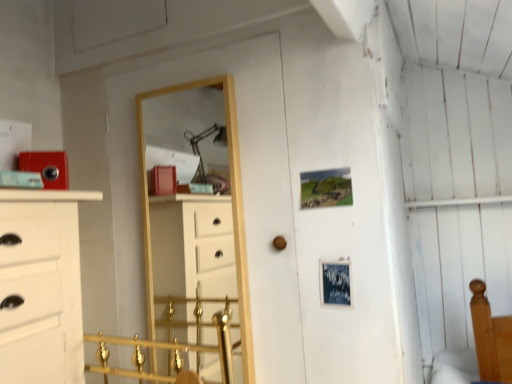
Image resolution: width=512 pixels, height=384 pixels. What do you see at coordinates (279, 243) in the screenshot? I see `brown matte door handle at center` at bounding box center [279, 243].

Identify the location of brown matte door handle at center. The width and height of the screenshot is (512, 384). (279, 243).

Where is `gold wooden mirror at center`? gold wooden mirror at center is located at coordinates (232, 211).

What is the approximate width of gold wooden mirror at center?

gold wooden mirror at center is 1.71 inches wide.

This screenshot has width=512, height=384. Describe the element at coordinates (232, 211) in the screenshot. I see `gold wooden mirror at center` at that location.

The image size is (512, 384). I want to click on brown matte door handle at center, so click(279, 243).

Considering the positions of objects brown matte door handle at center and gold wooden mirror at center in the image provided, who is more to the right, brown matte door handle at center or gold wooden mirror at center?

Positioned to the right is brown matte door handle at center.

Consider the image. In the image, is brown matte door handle at center positioned in front of or behind gold wooden mirror at center?

Visually, brown matte door handle at center is located in front of gold wooden mirror at center.

Which point is more distant from viewer, [278,244] or [142,117]?

The point [142,117] is behind.

From the image's perspective, would you say brown matte door handle at center is positioned over gold wooden mirror at center?

No, from the image's perspective, brown matte door handle at center is not over gold wooden mirror at center.

Consider the image. From a real-world perspective, who is located higher, brown matte door handle at center or gold wooden mirror at center?

From a 3D spatial view, gold wooden mirror at center is above.

Which object is wider, brown matte door handle at center or gold wooden mirror at center?

Wider between the two is gold wooden mirror at center.

Is brown matte door handle at center shorter than gold wooden mirror at center?

Yes, brown matte door handle at center is shorter than gold wooden mirror at center.

Considering the sizes of objects brown matte door handle at center and gold wooden mirror at center in the image provided, who is smaller, brown matte door handle at center or gold wooden mirror at center?

brown matte door handle at center is smaller.

Is brown matte door handle at center spatially inside gold wooden mirror at center, or outside of it?

brown matte door handle at center lies outside gold wooden mirror at center.

Is brown matte door handle at center not near gold wooden mirror at center?

Actually, brown matte door handle at center and gold wooden mirror at center are a little close together.

Could you tell me if brown matte door handle at center is facing gold wooden mirror at center?

No, brown matte door handle at center is not oriented towards gold wooden mirror at center.

What's the angular difference between brown matte door handle at center and gold wooden mirror at center's facing directions?

0.834 degrees separate the facing orientations of brown matte door handle at center and gold wooden mirror at center.

Locate an element on the screen. Image resolution: width=512 pixels, height=384 pixels. door handle in front of the gold wooden mirror at center is located at coordinates (279, 243).

Is gold wooden mirror at center to the left of brown matte door handle at center from the viewer's perspective?

Yes, gold wooden mirror at center is to the left of brown matte door handle at center.

Is gold wooden mirror at center closer to the viewer compared to brown matte door handle at center?

No.

Which is further, (240, 168) or (273, 241)?

Point (240, 168)

From the image's perspective, is gold wooden mirror at center on top of brown matte door handle at center?

Correct, gold wooden mirror at center appears higher than brown matte door handle at center in the image.

From a real-world perspective, is gold wooden mirror at center physically below brown matte door handle at center?

Incorrect, from a real-world perspective, gold wooden mirror at center is higher than brown matte door handle at center.

Between gold wooden mirror at center and brown matte door handle at center, which one has smaller width?

With smaller width is brown matte door handle at center.

Considering the sizes of gold wooden mirror at center and brown matte door handle at center in the image, is gold wooden mirror at center taller or shorter than brown matte door handle at center?

Considering their sizes, gold wooden mirror at center has more height than brown matte door handle at center.

Considering the relative sizes of gold wooden mirror at center and brown matte door handle at center in the image provided, is gold wooden mirror at center smaller than brown matte door handle at center?

Incorrect, gold wooden mirror at center is not smaller in size than brown matte door handle at center.

Is brown matte door handle at center inside gold wooden mirror at center?

No, brown matte door handle at center is located outside of gold wooden mirror at center.

Is gold wooden mirror at center next to brown matte door handle at center?

They are not placed beside each other.

In the scene shown: Is gold wooden mirror at center positioned with its back to brown matte door handle at center?

No, gold wooden mirror at center's orientation is not away from brown matte door handle at center.

How different are the orientations of gold wooden mirror at center and brown matte door handle at center in degrees?

0.834 degrees separate the facing orientations of gold wooden mirror at center and brown matte door handle at center.

Find the location of `mirror lying behind the brown matte door handle at center`. mirror lying behind the brown matte door handle at center is located at coordinates (232, 211).

Identify the location of mirror to the left of brown matte door handle at center. The image size is (512, 384). (232, 211).

Identify the location of door handle below the gold wooden mirror at center (from a real-world perspective). (279, 243).